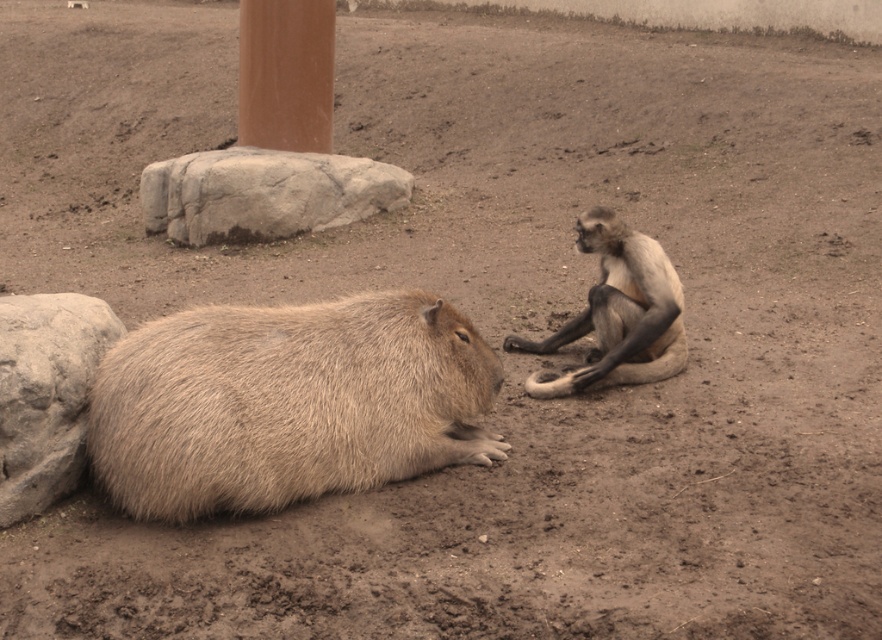
You are a zookeeper observing the enclosure. You need to place a new feeding tray between the fuzzy brown capybara at lower left and the brown polished stone pillar at upper center. Based on their positions, where should you position the feeding tray?

The feeding tray should be placed between the fuzzy brown capybara at lower left and the brown polished stone pillar at upper center. Since the fuzzy brown capybara at lower left is to the right of the brown polished stone pillar at upper center, the feeding tray should be positioned to the right of the pillar and to the left of the capybara to ensure it is between them.

You are a zookeeper who needs to place a new feeding tray between the gray rough rock at center and the brown polished stone pillar at upper center. The tray requires a minimum of 22 inches of space to fit. Can the tray be placed there?

The gray rough rock at center is 21.96 inches from the brown polished stone pillar at upper center, which is slightly less than the required 22 inches. Therefore, the feeding tray cannot be placed there as it does not meet the space requirement.

Based on the photo, you are standing in the enclosure and want to place a small toy between the gray rough rock at center and the brown polished stone pillar at upper center. Which object should you move closer to you to create space?

The gray rough rock at center is closer to the viewer than the brown polished stone pillar at upper center. To create space, you should move the gray rough rock at center away from you since it is the closer object.